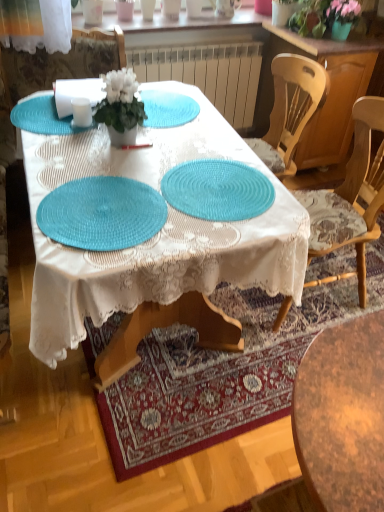
Locate an element on the screen. The image size is (384, 512). free space to the left of teal woven placemat at center, the second glass plate positioned from the bottom is located at coordinates (116, 190).